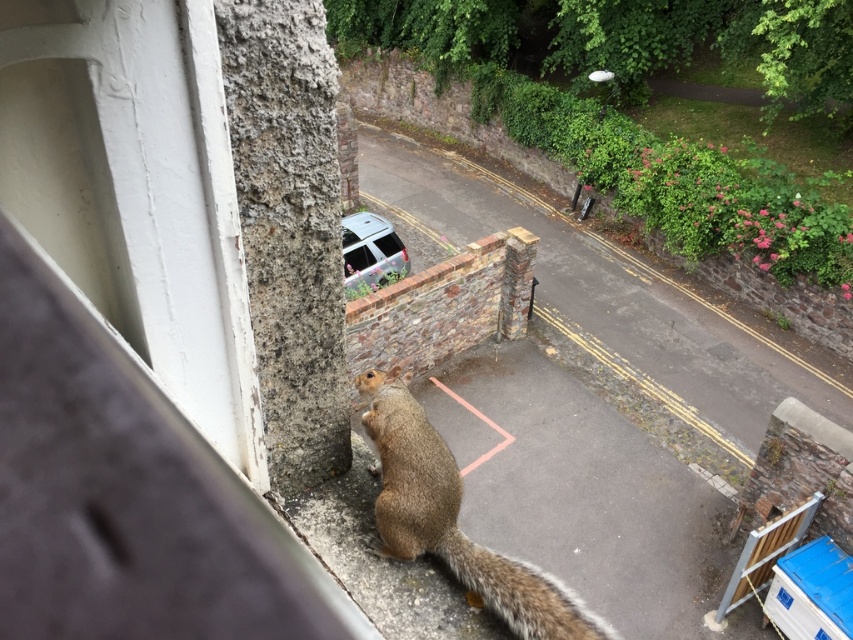
You are standing at the window frame on the left side of the image. You see a point marked at coordinates (453, 518). What object is located at that point?

The point at coordinates (453, 518) marks the location of the brown furry squirrel at lower center.

You are trying to determine if the brown furry squirrel at lower center can fit through a narrow opening that is just wide enough for the fuzzy brown tail at lower center. Based on their widths, will the squirrel fit?

The brown furry squirrel at lower center might be wider than fuzzy brown tail at lower center, so it might not fit through the opening that accommodates the tail.

Consider the image. You are standing on the balcony and see the brown furry squirrel at lower center and its fuzzy brown tail at lower center. Which one is taller?

The brown furry squirrel at lower center is much taller than the fuzzy brown tail at lower center.